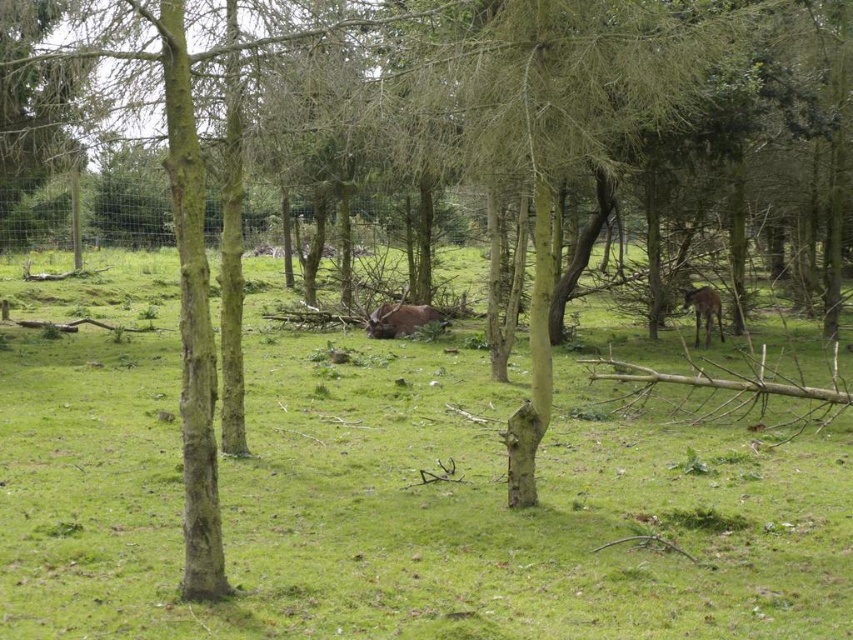
Question: Among these points, which one is nearest to the camera?

Choices:
 (A) (381, 324)
 (B) (802, 612)

Answer: (B)

Question: Which of the following is the closest to the observer?

Choices:
 (A) brown furry deer at right
 (B) brown furry bull at center

Answer: (A)

Question: Does brown furry bull at center have a lesser width compared to brown furry deer at right?

Choices:
 (A) yes
 (B) no

Answer: (B)

Question: Considering the real-world distances, which object is farthest from the green grassy field at center?

Choices:
 (A) brown furry bull at center
 (B) brown furry deer at right

Answer: (B)

Question: Can you confirm if green grassy field at center is wider than brown furry bull at center?

Choices:
 (A) no
 (B) yes

Answer: (B)

Question: Can you confirm if green grassy field at center is wider than brown furry deer at right?

Choices:
 (A) yes
 (B) no

Answer: (A)